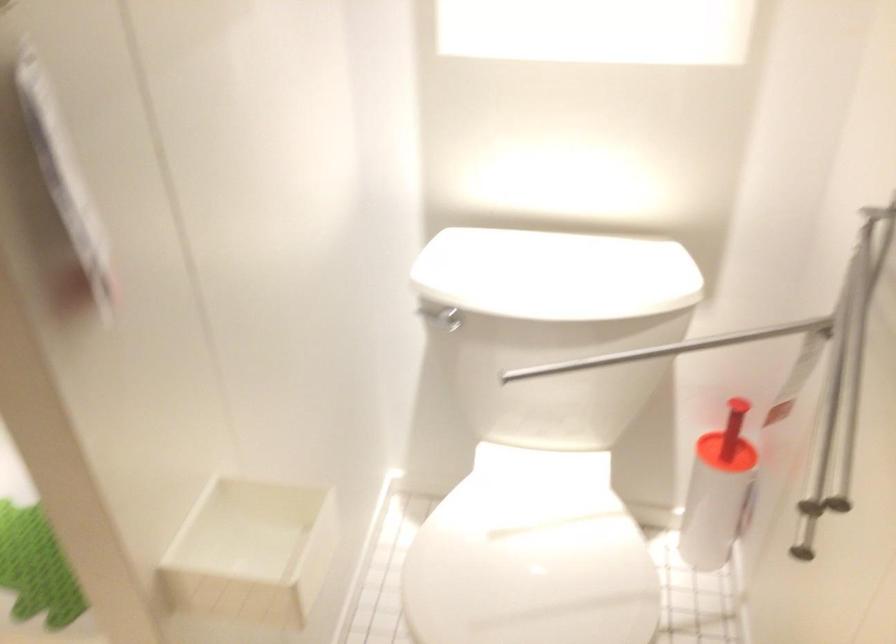
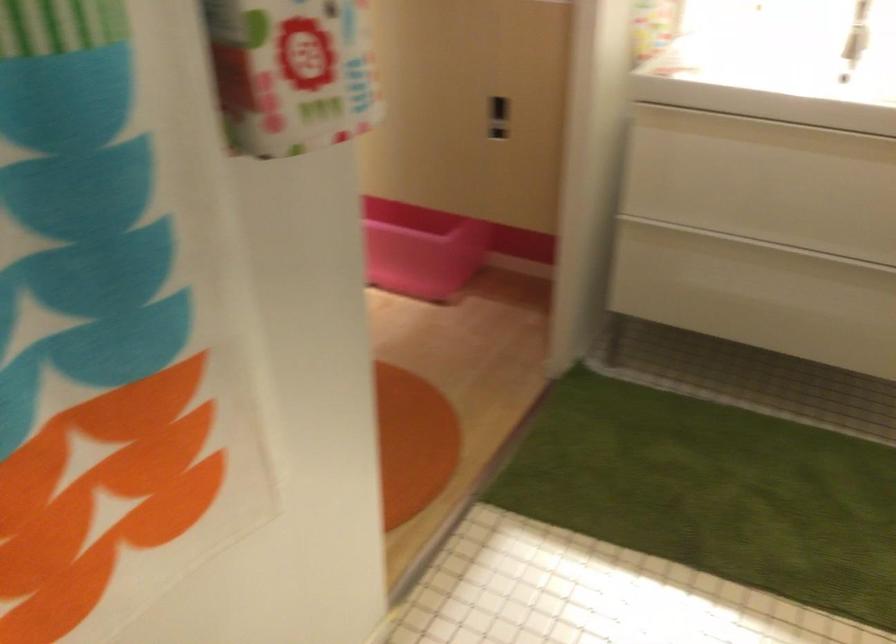
First-person continuous shooting, in which direction is the camera rotating?

The camera rotated toward left-down.